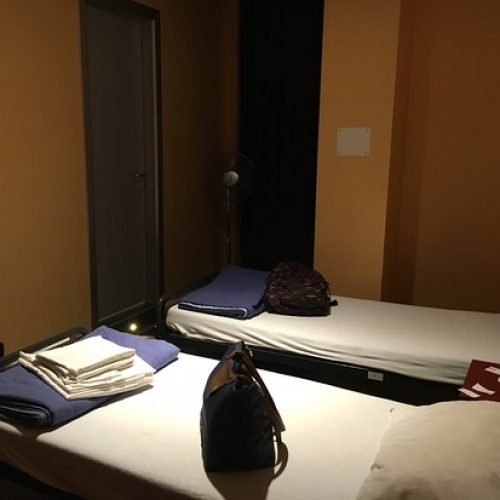
At what (x,y) coordinates should I click in order to perform the action: click on door knob. Please return your answer as a coordinate pair (x, y). The image size is (500, 500). Looking at the image, I should click on (142, 175).